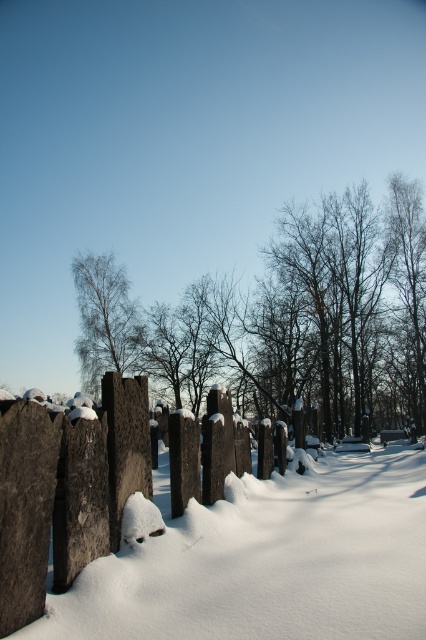
Who is more forward, (176, 316) or (129, 424)?

Point (129, 424) is in front.

Between snow-covered tree at center and dark gray stone fence at center, which one appears on the right side from the viewer's perspective?

snow-covered tree at center is more to the right.

Between point (356, 243) and point (101, 461), which one is positioned in front?

Point (101, 461) is in front.

The image size is (426, 640). I want to click on snow-covered tree at center, so click(x=287, y=317).

Is snow-covered tree at center above bare birch tree at center?

Incorrect, snow-covered tree at center is not positioned above bare birch tree at center.

Looking at this image, can you confirm if snow-covered tree at center is thinner than bare birch tree at center?

No.

Is point (287, 355) closer to camera compared to point (115, 259)?

Yes, point (287, 355) is in front of point (115, 259).

You are a GUI agent. You are given a task and a screenshot of the screen. Output one action in this format:
    pyautogui.click(x=<x>, y=<y>)
    Task: Click on the snow-covered tree at center
    This screenshot has width=426, height=640.
    Given the screenshot: What is the action you would take?
    pyautogui.click(x=287, y=317)

Can you confirm if dark gray stone fence at center is shorter than bare birch tree at center?

Yes.

Can you confirm if dark gray stone fence at center is positioned to the right of bare birch tree at center?

Yes, dark gray stone fence at center is to the right of bare birch tree at center.

This screenshot has height=640, width=426. I want to click on dark gray stone fence at center, so click(66, 490).